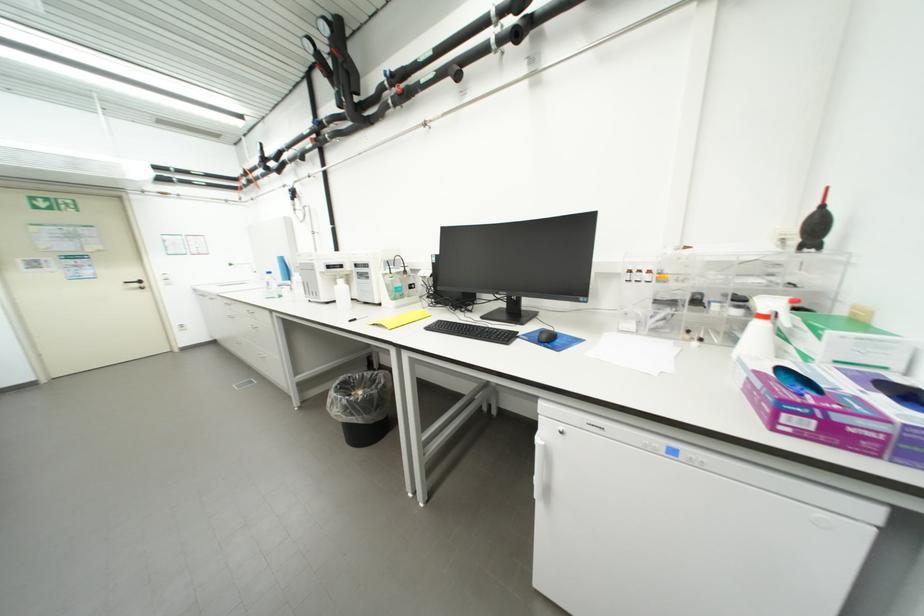
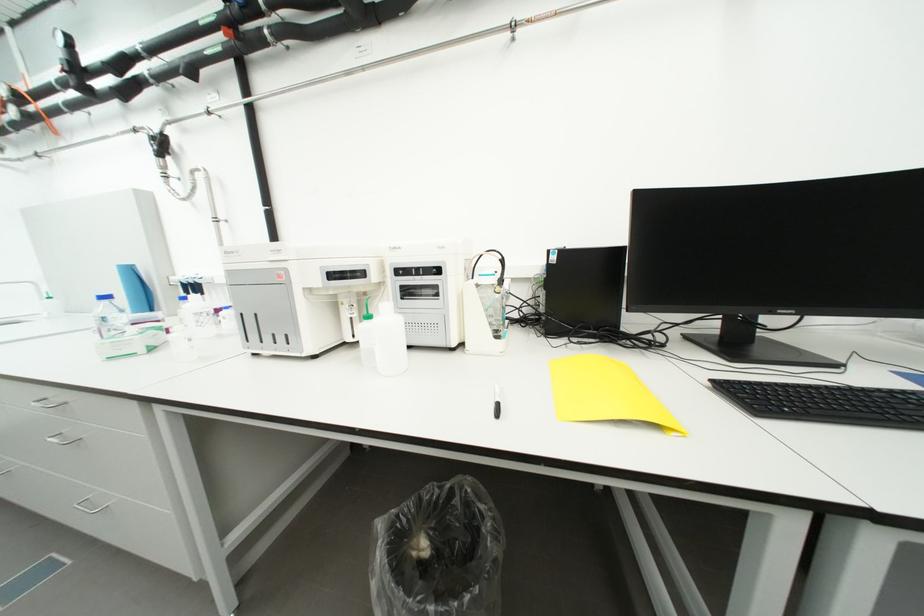
Locate, in the second image, the point that corresponds to (x=442, y=261) in the first image.

(562, 259)